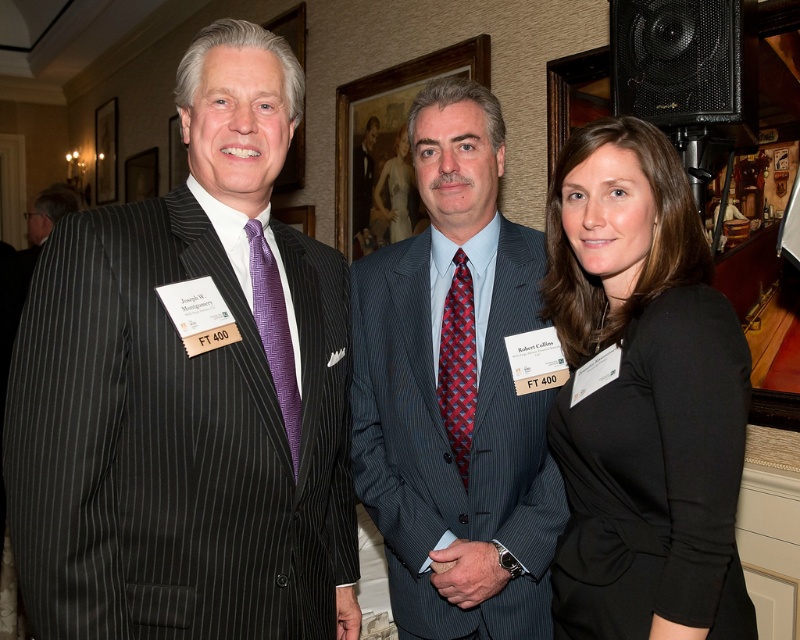
You are at a formal event and need to locate the black mesh speaker at upper right and the smooth white dress at center. Which object is positioned lower in the image?

The black mesh speaker at upper right is located below the smooth white dress at center, so the black mesh speaker at upper right is positioned lower in the image.